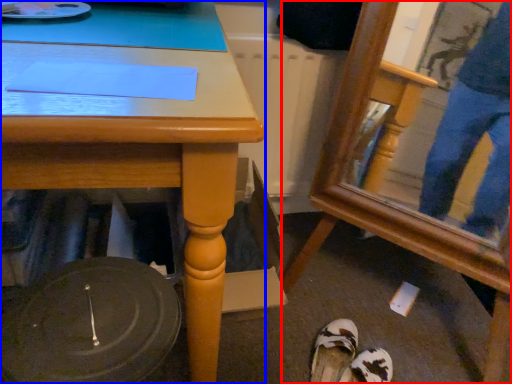
Question: Which of the following is the closest to the observer, swivel chair (highlighted by a red box) or desk (highlighted by a blue box)?

Choices:
 (A) swivel chair
 (B) desk

Answer: (B)